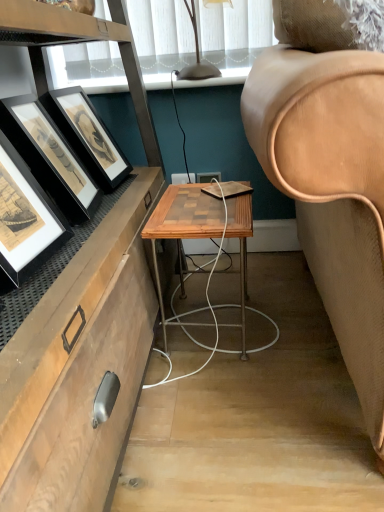
Question: Is black matte picture frame at left, the second picture frame from the back, wider than matte black table lamp at upper center?

Choices:
 (A) yes
 (B) no

Answer: (A)

Question: Does black matte picture frame at left, acting as the first picture frame starting from the front, appear on the left side of matte black table lamp at upper center?

Choices:
 (A) no
 (B) yes

Answer: (B)

Question: Does black matte picture frame at left, the second picture frame from the back, have a smaller size compared to matte black table lamp at upper center?

Choices:
 (A) yes
 (B) no

Answer: (B)

Question: Is black matte picture frame at left, acting as the first picture frame starting from the front, next to matte black table lamp at upper center?

Choices:
 (A) yes
 (B) no

Answer: (B)

Question: Can you confirm if black matte picture frame at left, the second picture frame from the back, is bigger than matte black table lamp at upper center?

Choices:
 (A) yes
 (B) no

Answer: (A)

Question: Is matte black table lamp at upper center at the back of black matte picture frame at left, the second picture frame from the back?

Choices:
 (A) no
 (B) yes

Answer: (A)

Question: From the image's perspective, does black matte picture frame at left, acting as the first picture frame starting from the front, appear higher than woodenmaterial/texturetable at center?

Choices:
 (A) no
 (B) yes

Answer: (B)

Question: Is black matte picture frame at left, acting as the first picture frame starting from the front, located outside woodenmaterial/texturetable at center?

Choices:
 (A) no
 (B) yes

Answer: (B)

Question: Considering the relative sizes of black matte picture frame at left, the second picture frame from the back, and woodenmaterial/texturetable at center in the image provided, is black matte picture frame at left, the second picture frame from the back, smaller than woodenmaterial/texturetable at center?

Choices:
 (A) yes
 (B) no

Answer: (A)

Question: Is black matte picture frame at left, acting as the first picture frame starting from the front, beside woodenmaterial/texturetable at center?

Choices:
 (A) no
 (B) yes

Answer: (A)

Question: Does black matte picture frame at left, acting as the first picture frame starting from the front, have a larger size compared to woodenmaterial/texturetable at center?

Choices:
 (A) yes
 (B) no

Answer: (B)

Question: From a real-world perspective, is black matte picture frame at left, acting as the first picture frame starting from the front, beneath woodenmaterial/texturetable at center?

Choices:
 (A) yes
 (B) no

Answer: (B)

Question: Is woodenmaterial/texturetable at center facing away from matte black table lamp at upper center?

Choices:
 (A) yes
 (B) no

Answer: (B)